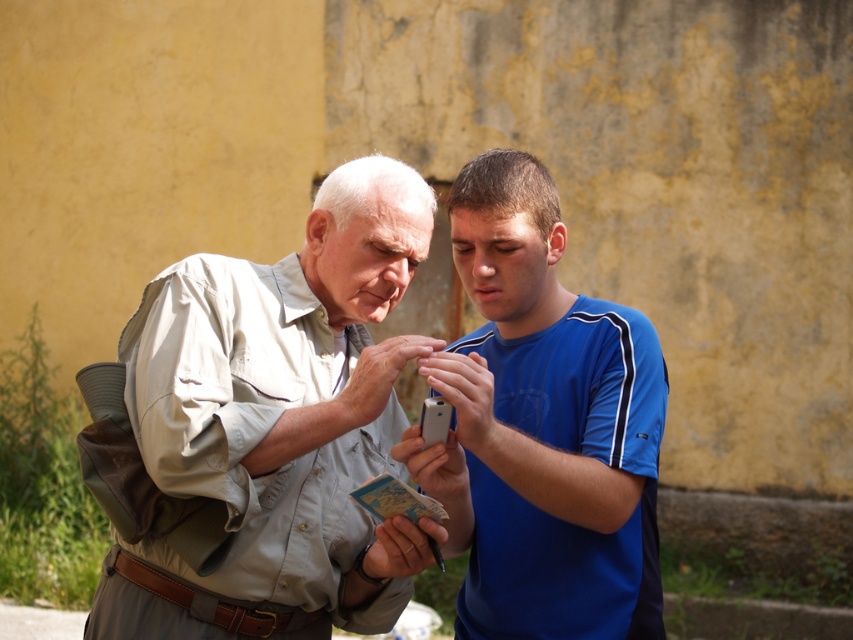
Question: Is light beige shirt at center bigger than blue smooth shirt at center?

Choices:
 (A) yes
 (B) no

Answer: (A)

Question: Can you confirm if light beige shirt at center is bigger than blue smooth shirt at center?

Choices:
 (A) yes
 (B) no

Answer: (A)

Question: Which point is farther to the camera?

Choices:
 (A) blue smooth shirt at center
 (B) light beige shirt at center

Answer: (B)

Question: Which point is closer to the camera?

Choices:
 (A) blue smooth shirt at center
 (B) light beige shirt at center

Answer: (A)

Question: Can you confirm if light beige shirt at center is positioned to the right of blue smooth shirt at center?

Choices:
 (A) no
 (B) yes

Answer: (A)